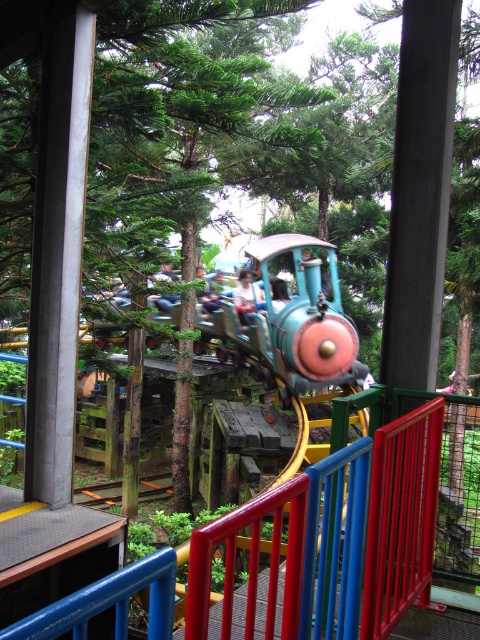
Question: From the image, what is the correct spatial relationship of shiny blue train at center in relation to light blue fabric shirt at center?

Choices:
 (A) right
 (B) left

Answer: (A)

Question: Which point is closer to the camera?

Choices:
 (A) (316, 326)
 (B) (248, 276)

Answer: (A)

Question: In this image, where is shiny blue train at center located relative to light blue fabric shirt at center?

Choices:
 (A) left
 (B) right

Answer: (B)

Question: Does shiny blue train at center have a greater width compared to light blue fabric shirt at center?

Choices:
 (A) no
 (B) yes

Answer: (B)

Question: Which point is closer to the camera taking this photo?

Choices:
 (A) (265, 317)
 (B) (247, 276)

Answer: (A)